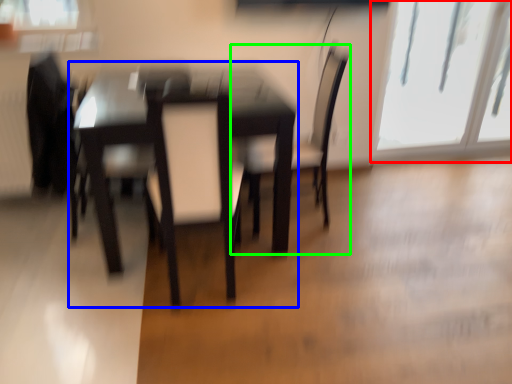
Question: Considering the real-world distances, which object is farthest from window (highlighted by a red box)? table (highlighted by a blue box) or chair (highlighted by a green box)?

Choices:
 (A) table
 (B) chair

Answer: (A)